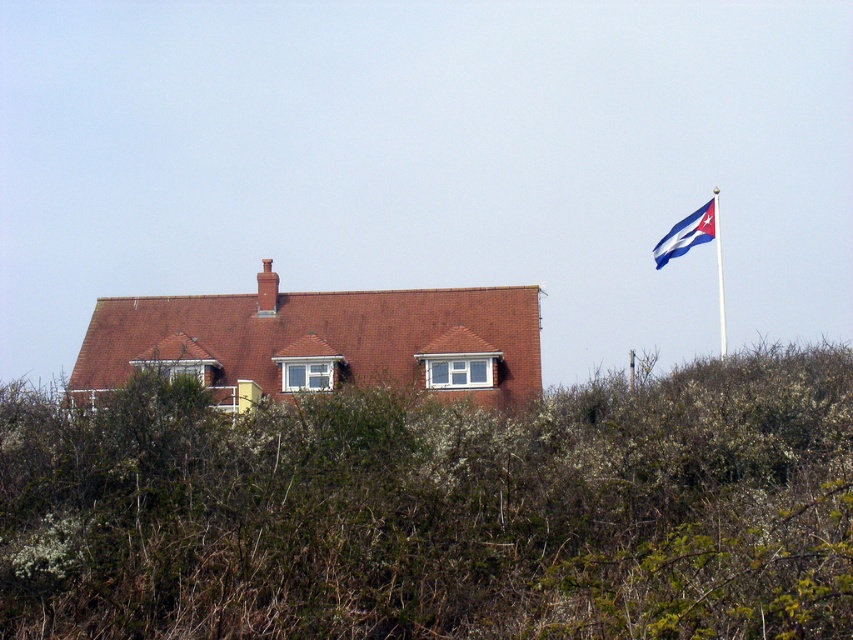
You are standing in front of the house and notice the blue fabric flag at upper right and the white plastic flag pole at upper right. Which object is closer to you?

The blue fabric flag at upper right is closer to you than the white plastic flag pole at upper right because it is further to the viewer.